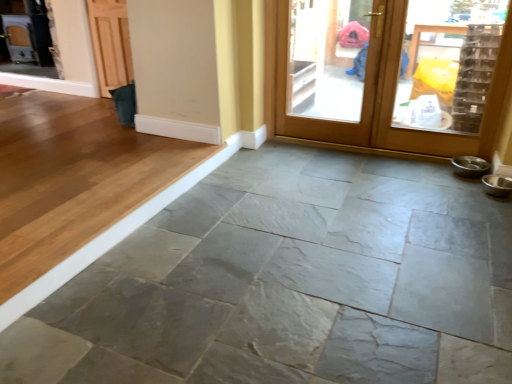
You are a GUI agent. You are given a task and a screenshot of the screen. Output one action in this format:
    pyautogui.click(x=<x>, y=<y>)
    Task: Click on the blank space above gray stone floor at center (from a real-world perspective)
    
    Given the screenshot: What is the action you would take?
    pyautogui.click(x=296, y=261)